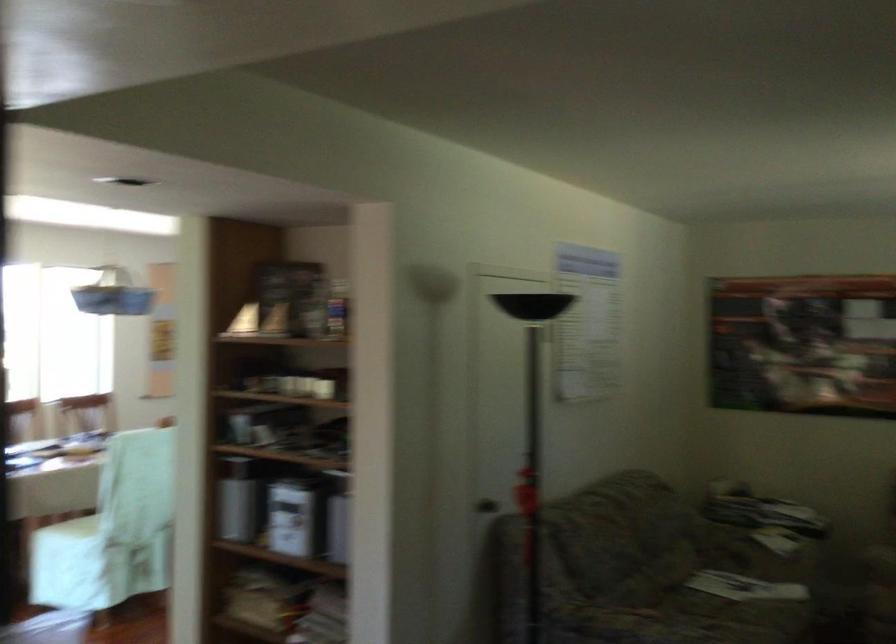
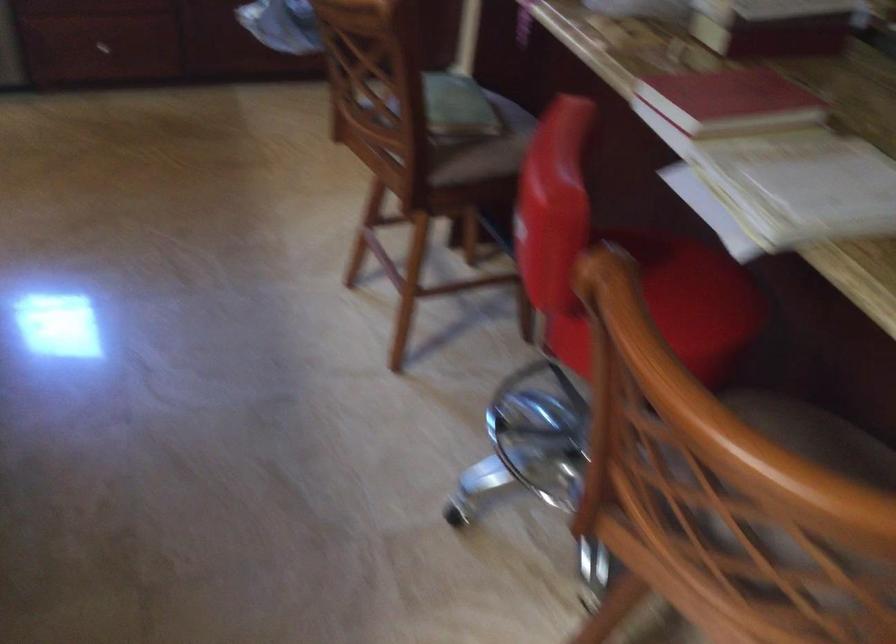
First-person continuous shooting, in which direction is the camera rotating?

The rotation direction of the camera is left-down.